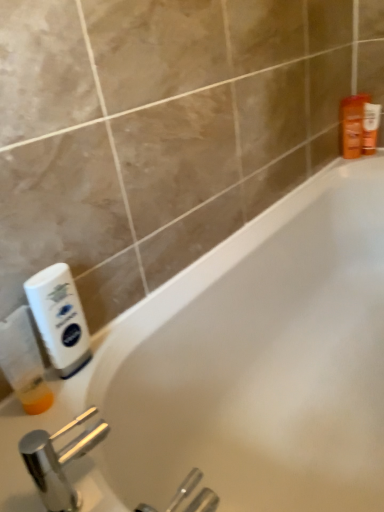
This screenshot has height=512, width=384. I want to click on vacant space that's between translucent plastic bottle at left, positioned as the second cleaning product in right-to-left order, and polished chrome faucet at lower left, so click(x=57, y=444).